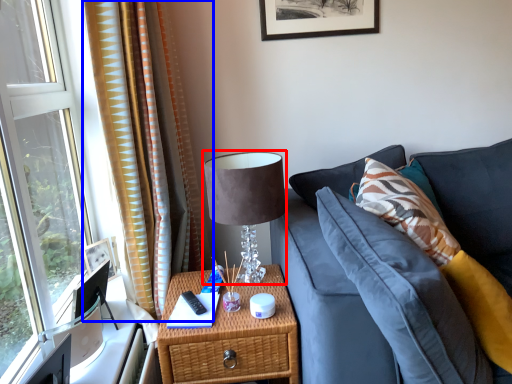
Question: Which object appears farthest to the camera in this image, table lamp (highlighted by a red box) or curtain (highlighted by a blue box)?

Choices:
 (A) table lamp
 (B) curtain

Answer: (A)